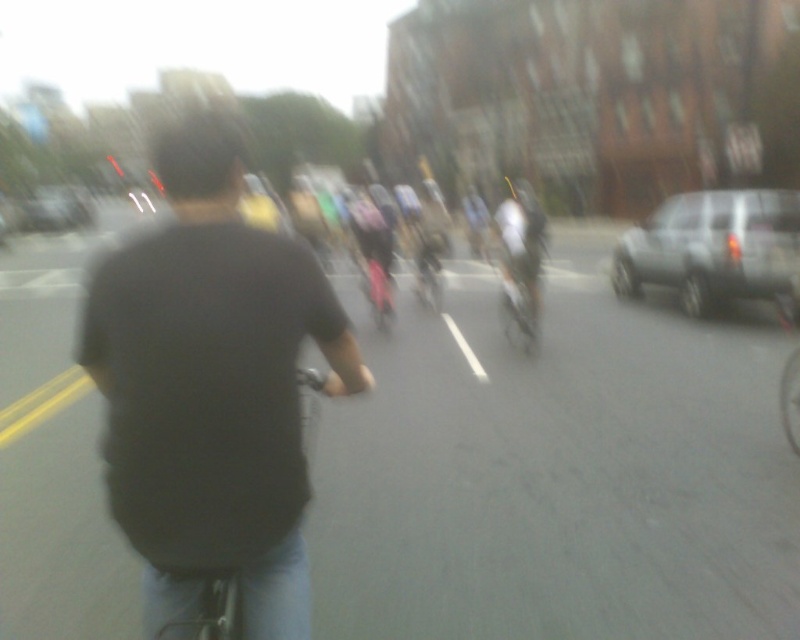
Question: Is silver metallic suv at right smaller than silver metallic bicycle at center?

Choices:
 (A) yes
 (B) no

Answer: (B)

Question: Which of the following is the closest to the observer?

Choices:
 (A) (304, 452)
 (B) (332, 316)
 (C) (621, 275)
 (D) (509, 276)

Answer: (B)

Question: Which object is positioned closest to the black matte shirt at center?

Choices:
 (A) silver metallic bicycle at center
 (B) silver metallic suv at right

Answer: (A)

Question: Observing the image, what is the correct spatial positioning of black matte bicycle at center in reference to silver metallic bicycle at center?

Choices:
 (A) right
 (B) left

Answer: (B)

Question: Estimate the real-world distances between objects in this image. Which object is closer to the black matte shirt at center?

Choices:
 (A) black matte bicycle at center
 (B) silver metallic bicycle at center

Answer: (A)

Question: Does black matte shirt at center have a smaller size compared to silver metallic bicycle at center?

Choices:
 (A) yes
 (B) no

Answer: (B)